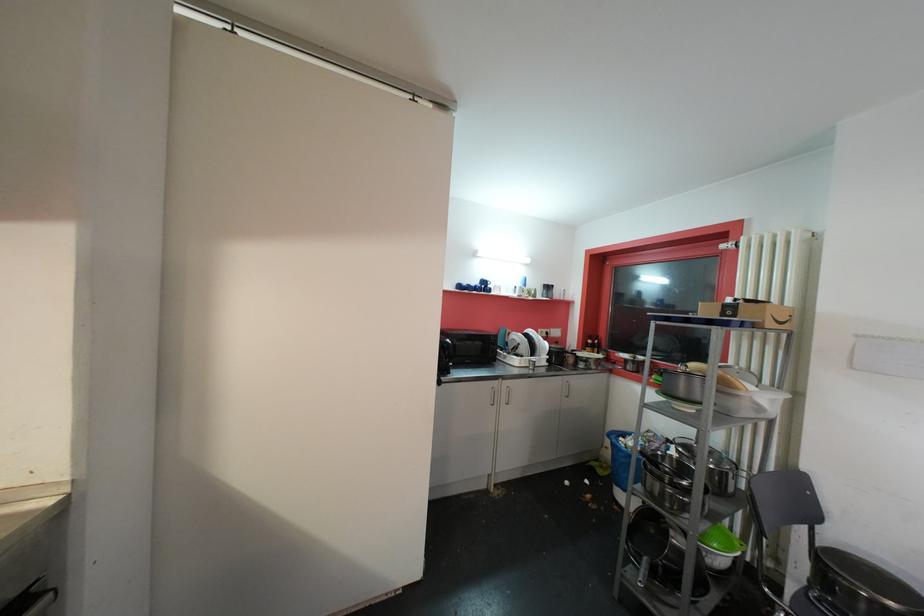
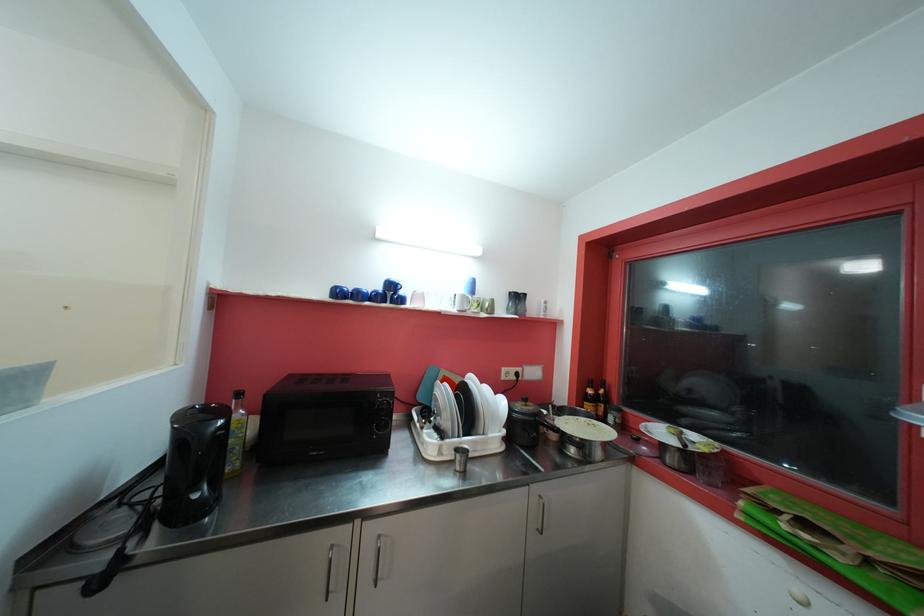
Find the pixel in the second image that matches [562,345] in the first image.

(530, 403)